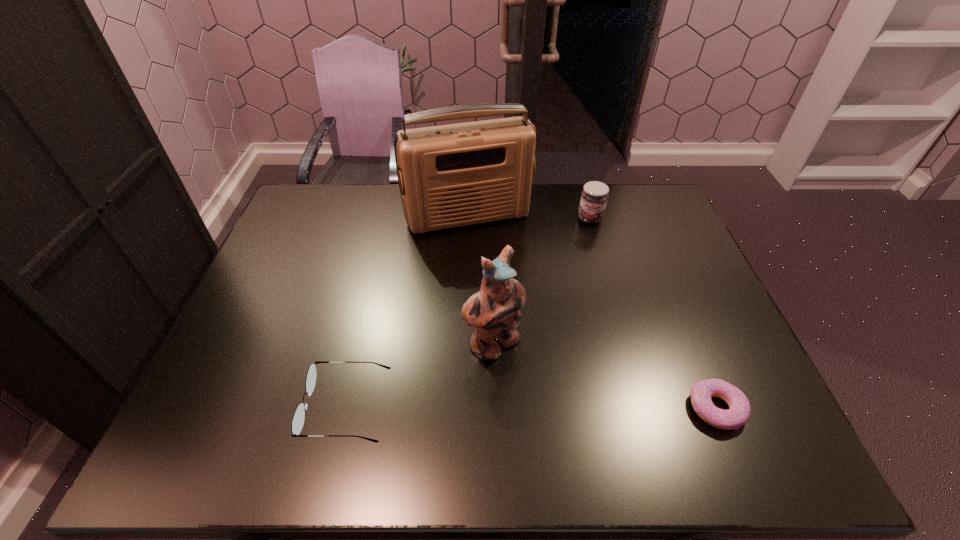
This screenshot has width=960, height=540. I want to click on object that is the third closest to the radio receiver, so click(x=298, y=419).

You are a GUI agent. You are given a task and a screenshot of the screen. Output one action in this format:
    pyautogui.click(x=<x>, y=<y>)
    Task: Click on the closest object to the rightmost object
    The height and width of the screenshot is (540, 960).
    Given the screenshot: What is the action you would take?
    pyautogui.click(x=493, y=312)

This screenshot has height=540, width=960. I want to click on free spot that satisfies the following two spatial constraints: 1. on the front side of the shortest object; 2. on the right side of the radio receiver, so click(x=463, y=408).

I want to click on free spot that satisfies the following two spatial constraints: 1. on the front side of the radio receiver; 2. on the right side of the rightmost object, so click(x=463, y=408).

Where is `vacant point that satisfies the following two spatial constraints: 1. on the front side of the tallest object; 2. on the left side of the second object from right to left`? This screenshot has width=960, height=540. vacant point that satisfies the following two spatial constraints: 1. on the front side of the tallest object; 2. on the left side of the second object from right to left is located at coordinates (468, 218).